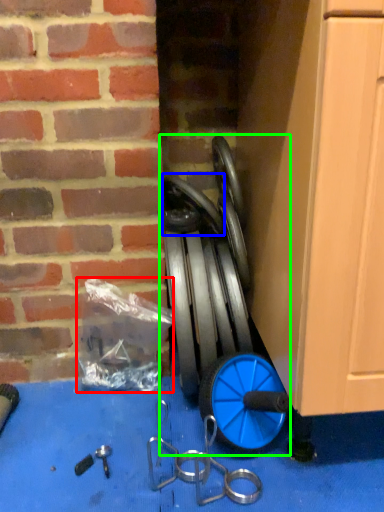
Question: Which object is the closest to the garbage (highlighted by a red box)? Choose among these: wheel (highlighted by a blue box) or garden hose (highlighted by a green box).

Choices:
 (A) wheel
 (B) garden hose

Answer: (B)